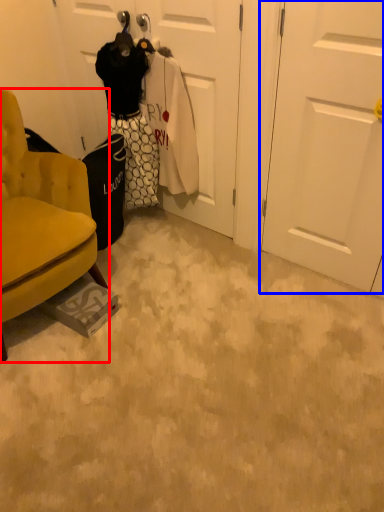
Question: Which object appears closest to the camera in this image, chair (highlighted by a red box) or door (highlighted by a blue box)?

Choices:
 (A) chair
 (B) door

Answer: (A)